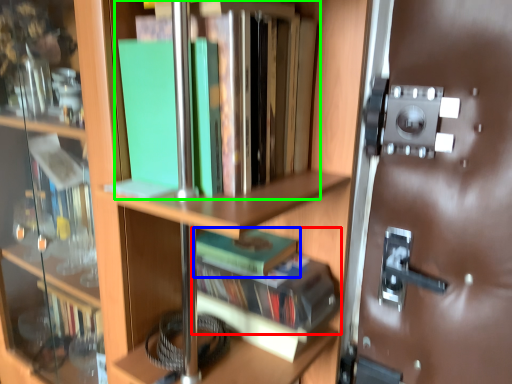
Question: Which object is the farthest from book (highlighted by a red box)? Choose among these: book (highlighted by a blue box) or book (highlighted by a green box).

Choices:
 (A) book
 (B) book

Answer: (B)